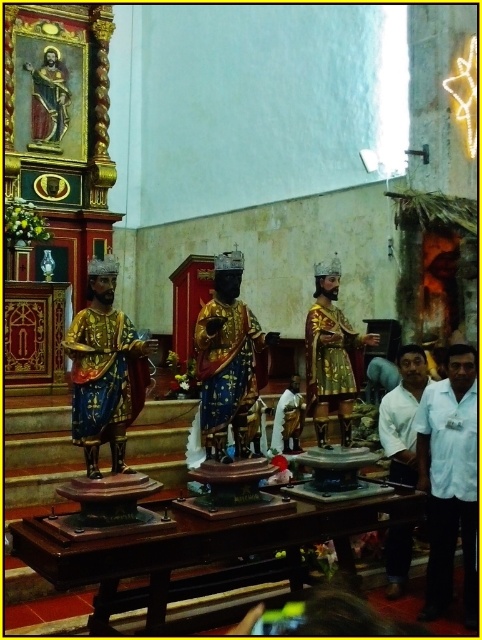
Question: Which of the following is the farthest from the observer?

Choices:
 (A) gold metallic statue at left
 (B) white shirt at right

Answer: (B)

Question: Does gold textured statue at center come in front of white shirt at lower right?

Choices:
 (A) yes
 (B) no

Answer: (A)

Question: Can you confirm if gold textured statue at center is thinner than white shirt at lower right?

Choices:
 (A) yes
 (B) no

Answer: (B)

Question: Does white shirt at right have a larger size compared to gold metallic statue at center?

Choices:
 (A) no
 (B) yes

Answer: (A)

Question: Considering the real-world distances, which object is closest to the gold metallic statue at center?

Choices:
 (A) gold textured statue at center
 (B) white shirt at right
 (C) white shirt at lower right

Answer: (A)

Question: Estimate the real-world distances between objects in this image. Which object is farther from the white shirt at right?

Choices:
 (A) gold metallic statue at center
 (B) white shirt at lower right

Answer: (A)